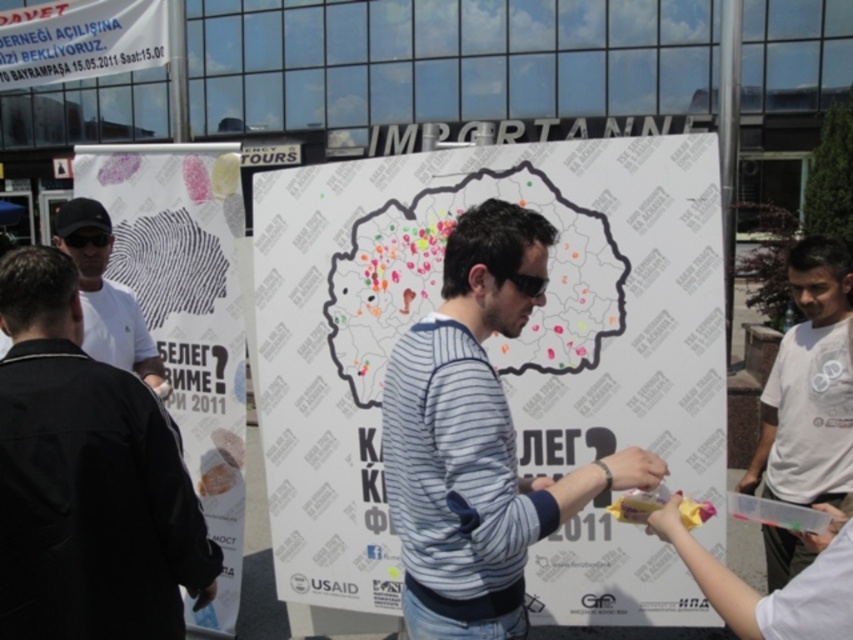
I want to click on white paper poster at left, so click(187, 316).

Between white paper poster at left and white cotton t-shirt at right, which one has more height?

Standing taller between the two is white paper poster at left.

Is point (198, 220) in front of point (761, 465)?

No, (198, 220) is further to viewer.

At what (x,y) coordinates should I click in order to perform the action: click on white paper poster at left. Please return your answer as a coordinate pair (x, y). The image size is (853, 640). Looking at the image, I should click on (187, 316).

Is white cotton t-shirt at right further to the viewer compared to white matte shirt at left?

No, white cotton t-shirt at right is in front of white matte shirt at left.

Does white cotton t-shirt at right lie in front of white matte shirt at left?

Yes.

Where is `white cotton t-shirt at right`? The width and height of the screenshot is (853, 640). white cotton t-shirt at right is located at coordinates (809, 385).

At what (x,y) coordinates should I click in order to perform the action: click on white cotton t-shirt at right. Please return your answer as a coordinate pair (x, y). The height and width of the screenshot is (640, 853). Looking at the image, I should click on (809, 385).

Is white paper map at center bigger than white cotton t-shirt at right?

→ Indeed, white paper map at center has a larger size compared to white cotton t-shirt at right.

Is white paper map at center wider than white cotton t-shirt at right?

Yes, white paper map at center is wider than white cotton t-shirt at right.

Who is more distant from viewer, (328, 429) or (788, 378)?

The point (328, 429) is more distant.

Identify the location of white paper map at center. This screenshot has width=853, height=640. (488, 339).